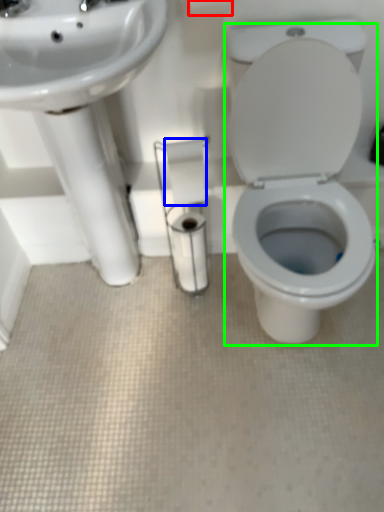
Question: Which object is the farthest from toilet paper (highlighted by a red box)? Choose among these: toilet paper (highlighted by a blue box) or porcelain (highlighted by a green box).

Choices:
 (A) toilet paper
 (B) porcelain

Answer: (B)